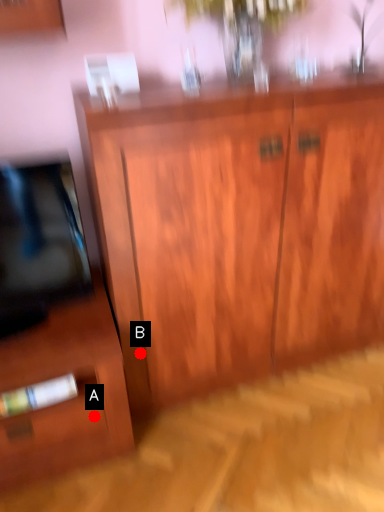
Question: Two points are circled on the image, labeled by A and B beside each circle. Which point is closer to the camera?

Choices:
 (A) A is closer
 (B) B is closer

Answer: (A)